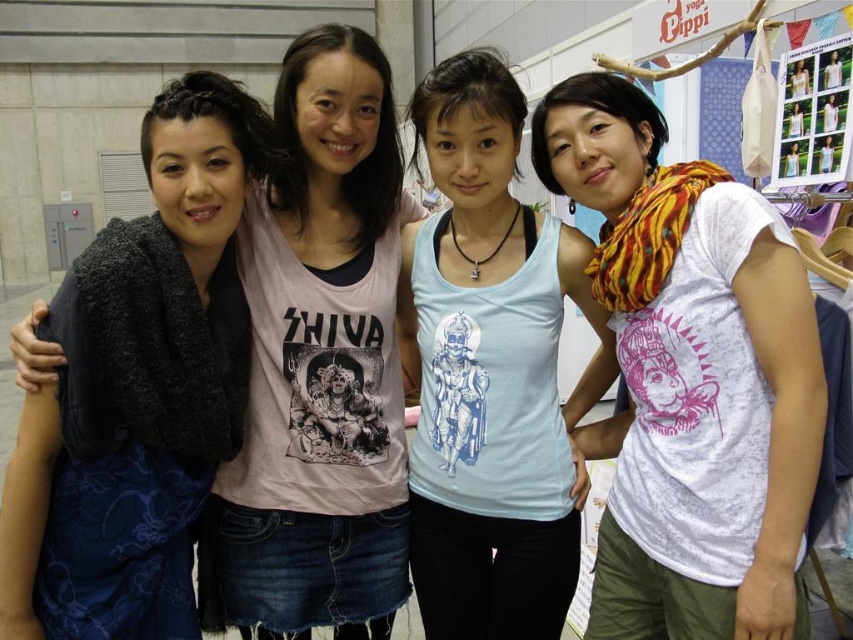
You are organizing a fashion show and need to decide which accessory or clothing item to feature first based on their size. Which item is narrower between the matte black scarf at left and the light blue tank top at center?

The matte black scarf at left is narrower than the light blue tank top at center.

You are a photographer trying to adjust the lighting for a group photo. You have a spotlight that can cover an area of 12 inches in diameter. The spotlight is currently positioned to illuminate the matte black scarf at left. Will the light also reach the light blue tank top at center?

The matte black scarf at left and light blue tank top at center are 10.46 inches apart. Since the spotlight can cover 12 inches, the light will reach the light blue tank top at center.